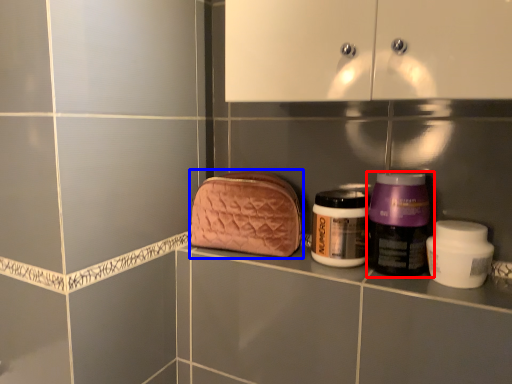
Question: Which object appears closest to the camera in this image, bottle (highlighted by a red box) or pouch (highlighted by a blue box)?

Choices:
 (A) bottle
 (B) pouch

Answer: (A)